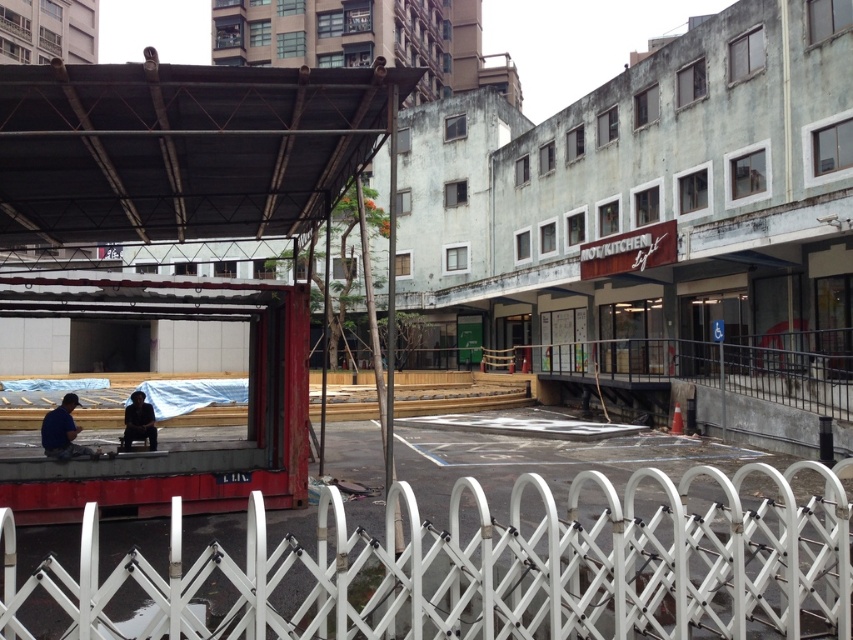
Question: Is rusty metal shelter at left to the left of blue fabric man at lower left from the viewer's perspective?

Choices:
 (A) no
 (B) yes

Answer: (A)

Question: Is white plastic fence at lower center wider than blue fabric man at lower left?

Choices:
 (A) yes
 (B) no

Answer: (A)

Question: Which of the following is the farthest from the observer?

Choices:
 (A) dark blue shirt at center
 (B) blue fabric man at lower left
 (C) black metal canopy at upper left
 (D) rusty metal shelter at left

Answer: (A)

Question: Which of the following is the farthest from the observer?

Choices:
 (A) dark blue shirt at center
 (B) black metal canopy at upper left
 (C) blue fabric man at lower left

Answer: (A)

Question: Is rusty metal shelter at left below dark blue shirt at center?

Choices:
 (A) no
 (B) yes

Answer: (A)

Question: Which is nearer to the dark blue shirt at center?

Choices:
 (A) white plastic fence at lower center
 (B) black metal canopy at upper left
 (C) rusty metal shelter at left
 (D) blue fabric man at lower left

Answer: (D)